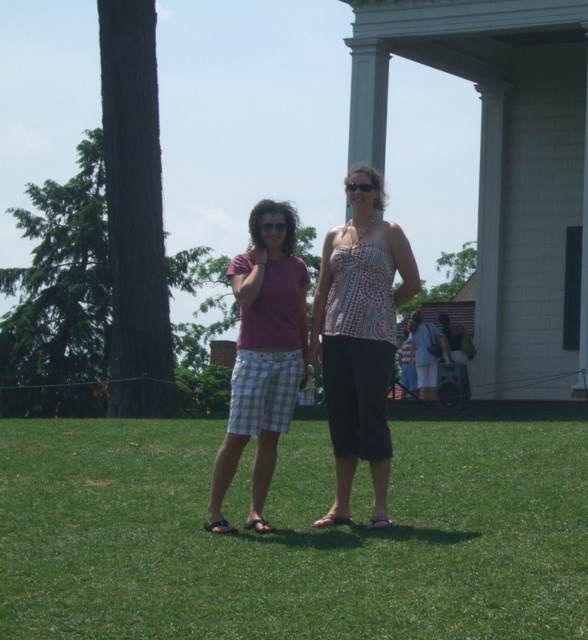
Who is lower down, green grass at center or printed fabric top at center?

green grass at center is below.

Which of these two, green grass at center or printed fabric top at center, stands shorter?

green grass at center is shorter.

What do you see at coordinates (292, 534) in the screenshot?
I see `green grass at center` at bounding box center [292, 534].

I want to click on green grass at center, so click(x=292, y=534).

Which of these two, printed fabric top at center or plaid shorts at center, stands shorter?

Standing shorter between the two is plaid shorts at center.

Does printed fabric top at center appear under plaid shorts at center?

No.

Which is behind, point (349, 172) or point (222, 465)?

Positioned behind is point (349, 172).

Locate an element on the screen. The width and height of the screenshot is (588, 640). printed fabric top at center is located at coordinates (359, 337).

Is point (203, 579) closer to viewer compared to point (230, 476)?

Yes, it is in front of point (230, 476).

Is green grass at center in front of plaid shorts at center?

Yes, it is.

Who is more forward, (489, 616) or (270, 205)?

Positioned in front is point (489, 616).

I want to click on green grass at center, so click(292, 534).